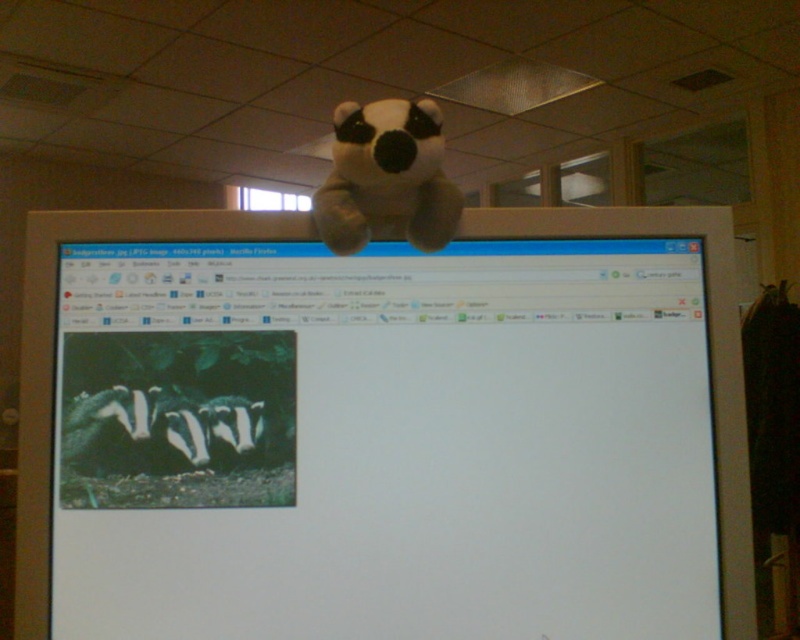
Does white matte monitor at center have a smaller size compared to soft plush panda at upper center?

Actually, white matte monitor at center might be larger than soft plush panda at upper center.

Based on the photo, who is more distant from viewer, (x=341, y=424) or (x=408, y=179)?

The point (x=341, y=424) is more distant.

Is point (380, 445) in front of point (348, 248)?

No.

Where is `white matte monitor at center`? white matte monitor at center is located at coordinates [x=414, y=432].